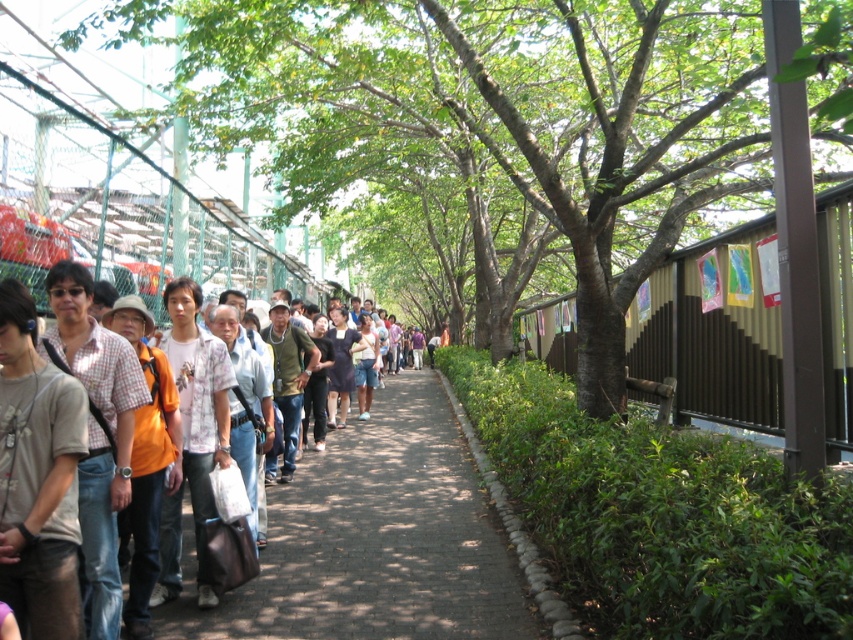
You are standing at the origin point of the image coordinate system. The origin is at the bottom left corner of the image. You want to walk towards the green leafy tree at center. In which direction should you move first?

Since the green leafy tree at center is located at coordinates approximately 0.186 along the x axis and 0.577 along the y axis, you should first move towards the right along the x axis to increase your x coordinate until it reaches 0.186, then move upwards along the y axis to reach the desired y coordinate of 0.577.

You are a tour guide leading a group of tourists along the shaded cobblestone pathway. You notice a tourist wearing a matte brown shirt at left is 9.13 meters away from the green leafy tree at center. If the average walking speed of a person is 1.4 meters per second, how many seconds will it take for the tourist to reach the tree if they start walking directly towards it?

The distance between the matte brown shirt at left and the green leafy tree at center is 9.13 meters. At an average walking speed of 1.4 meters per second, the time required would be 9.13 divided by 1.4, which equals approximately 6.52 seconds. Therefore, it will take roughly 6.5 seconds for the tourist to reach the tree.